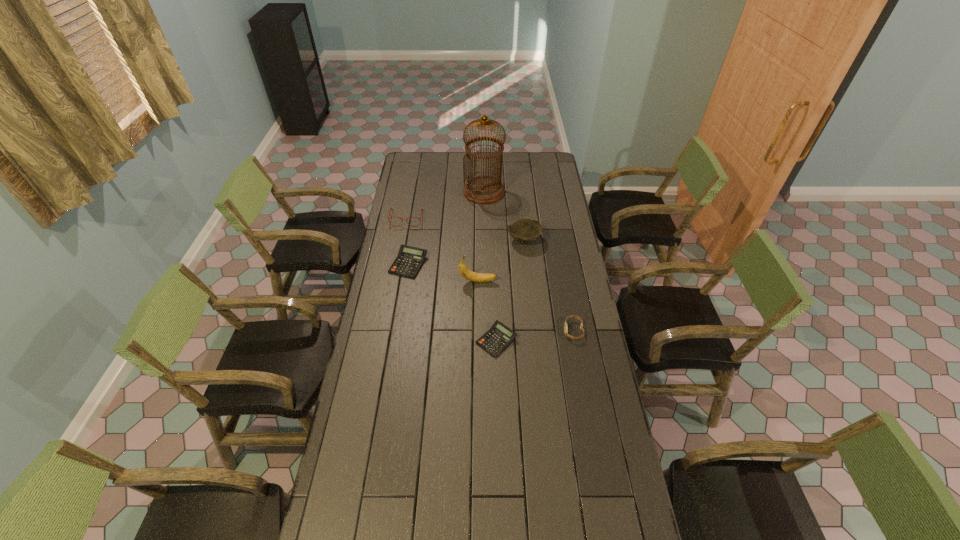
Where is `the second shortest object`? The width and height of the screenshot is (960, 540). the second shortest object is located at coordinates (409, 260).

The height and width of the screenshot is (540, 960). Identify the location of the farther calculator. (409, 260).

Where is `the shorter calculator`? Image resolution: width=960 pixels, height=540 pixels. the shorter calculator is located at coordinates (498, 337).

This screenshot has width=960, height=540. Identify the location of the right calculator. (498, 337).

The image size is (960, 540). In order to click on the tallest object in this screenshot , I will do `click(481, 189)`.

Image resolution: width=960 pixels, height=540 pixels. Find the location of `birdcage`. birdcage is located at coordinates (481, 189).

Identify the location of bowl. The width and height of the screenshot is (960, 540). (525, 230).

Locate an element on the screen. The height and width of the screenshot is (540, 960). the second farthest object is located at coordinates (391, 208).

At what (x,y) coordinates should I click in order to perform the action: click on spectacles. Please return your answer as a coordinate pair (x, y). Looking at the image, I should click on (391, 208).

At what (x,y) coordinates should I click in order to perform the action: click on banana. Please return your answer as a coordinate pair (x, y). Looking at the image, I should click on (463, 269).